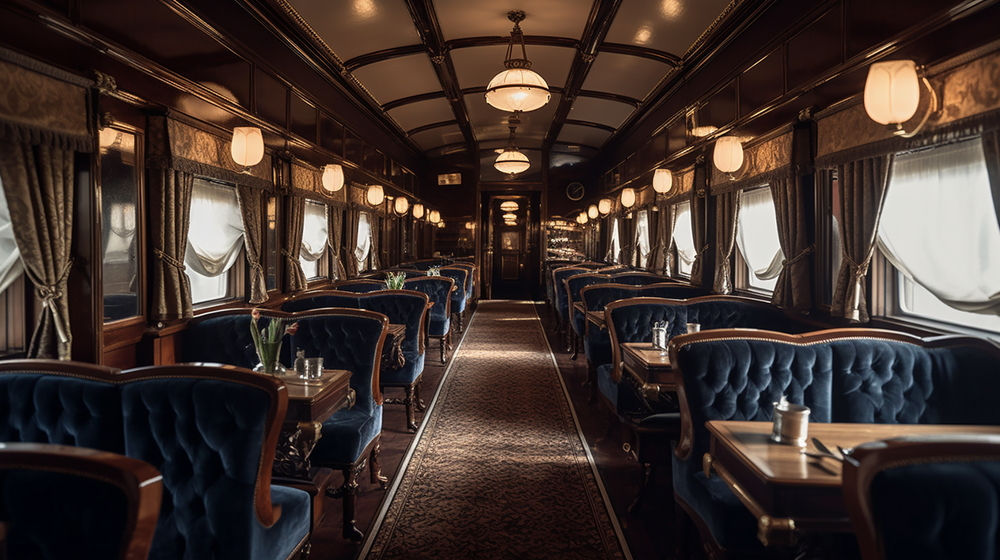
In order to click on tufted velvet upholstery in this screenshot , I will do `click(191, 459)`, `click(792, 368)`, `click(632, 312)`, `click(350, 348)`, `click(405, 310)`, `click(435, 293)`, `click(599, 298)`, `click(459, 278)`.